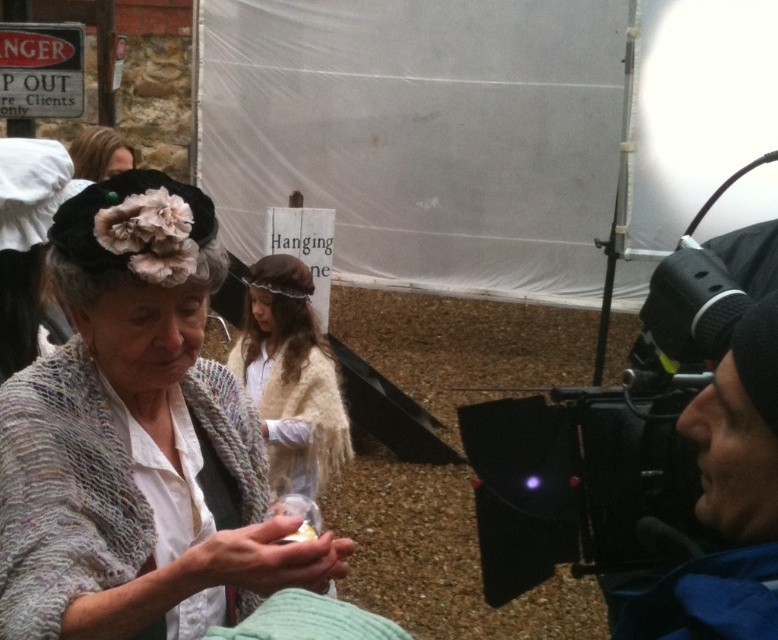
Is point (86, 563) positioned behind point (675, 467)?

No, (86, 563) is in front of (675, 467).

Is knitted woolen shawl at center taller than black matte video camera at right?

In fact, knitted woolen shawl at center may be shorter than black matte video camera at right.

The width and height of the screenshot is (778, 640). What do you see at coordinates (138, 440) in the screenshot?
I see `knitted woolen shawl at center` at bounding box center [138, 440].

This screenshot has width=778, height=640. Find the location of `knitted woolen shawl at center`. knitted woolen shawl at center is located at coordinates (138, 440).

Is knitted woolen shawl at center below beige woolen shawl at center?

Incorrect, knitted woolen shawl at center is not positioned below beige woolen shawl at center.

Looking at this image, does knitted woolen shawl at center have a lesser width compared to beige woolen shawl at center?

In fact, knitted woolen shawl at center might be wider than beige woolen shawl at center.

Is point (139, 620) in front of point (293, 404)?

Yes.

The height and width of the screenshot is (640, 778). I want to click on knitted woolen shawl at center, so click(x=138, y=440).

Can you confirm if knitted woolen shawl at center is positioned to the right of matte black hat at upper left?

Indeed, knitted woolen shawl at center is positioned on the right side of matte black hat at upper left.

Who is higher up, knitted woolen shawl at center or matte black hat at upper left?

matte black hat at upper left is above.

Is point (125, 384) closer to camera compared to point (114, 140)?

That is True.

Find the location of a particular element. knitted woolen shawl at center is located at coordinates (138, 440).